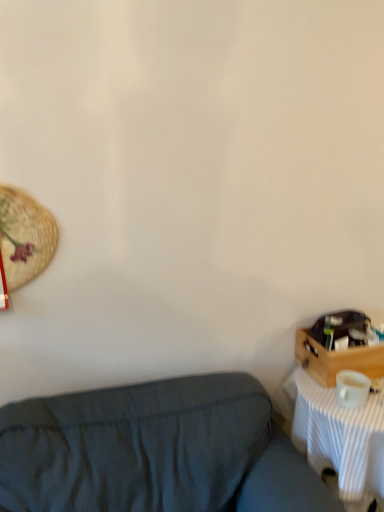
Question: Is wooden crate at right not near white matte coffee cup at right?

Choices:
 (A) yes
 (B) no

Answer: (B)

Question: Can you confirm if wooden crate at right is positioned to the left of white matte coffee cup at right?

Choices:
 (A) yes
 (B) no

Answer: (B)

Question: Is wooden crate at right closer to camera compared to white matte coffee cup at right?

Choices:
 (A) yes
 (B) no

Answer: (B)

Question: Considering the relative sizes of wooden crate at right and white matte coffee cup at right in the image provided, is wooden crate at right shorter than white matte coffee cup at right?

Choices:
 (A) yes
 (B) no

Answer: (B)

Question: Is wooden crate at right further to camera compared to white matte coffee cup at right?

Choices:
 (A) no
 (B) yes

Answer: (B)

Question: Does point (327, 389) appear closer or farther from the camera than point (342, 375)?

Choices:
 (A) farther
 (B) closer

Answer: (A)

Question: Considering the positions of white striped fabric at right and white matte coffee cup at right in the image, is white striped fabric at right wider or thinner than white matte coffee cup at right?

Choices:
 (A) wide
 (B) thin

Answer: (A)

Question: In terms of height, does white striped fabric at right look taller or shorter compared to white matte coffee cup at right?

Choices:
 (A) short
 (B) tall

Answer: (B)

Question: Which is correct: white striped fabric at right is inside white matte coffee cup at right, or outside of it?

Choices:
 (A) inside
 (B) outside

Answer: (B)

Question: From the image's perspective, is white striped fabric at right above or below wooden crate at right?

Choices:
 (A) below
 (B) above

Answer: (A)

Question: From a real-world perspective, relative to wooden crate at right, is white striped fabric at right vertically above or below?

Choices:
 (A) above
 (B) below

Answer: (B)

Question: Is white striped fabric at right taller or shorter than wooden crate at right?

Choices:
 (A) tall
 (B) short

Answer: (A)

Question: In terms of width, does white striped fabric at right look wider or thinner when compared to wooden crate at right?

Choices:
 (A) thin
 (B) wide

Answer: (B)

Question: In the image, is wooden crate at right positioned in front of or behind dark blue fabric couch at lower left?

Choices:
 (A) behind
 (B) front

Answer: (A)

Question: In the image, is wooden crate at right on the left side or the right side of dark blue fabric couch at lower left?

Choices:
 (A) left
 (B) right

Answer: (B)